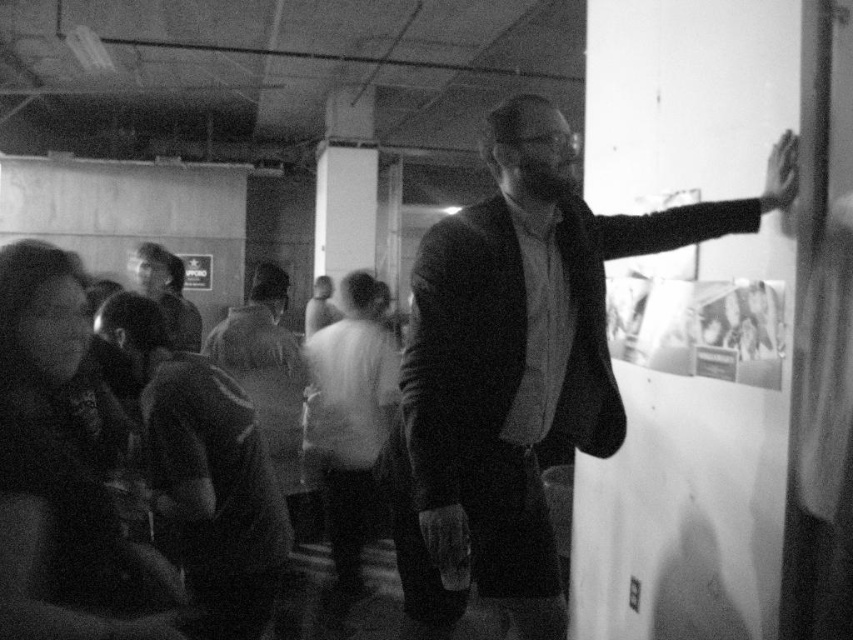
Question: Can you confirm if dark fabric jacket at lower left is smaller than smooth beige shirt at center?

Choices:
 (A) no
 (B) yes

Answer: (B)

Question: Can you confirm if dark fabric jacket at lower left is bigger than smooth skin hand at upper right?

Choices:
 (A) no
 (B) yes

Answer: (B)

Question: Which of the following is the closest to the observer?

Choices:
 (A) matte black suit at center
 (B) smooth skin hand at upper right
 (C) dark fabric jacket at lower left

Answer: (A)

Question: Is matte black suit at center to the right of smooth skin hand at upper right from the viewer's perspective?

Choices:
 (A) yes
 (B) no

Answer: (B)

Question: Which object appears farthest from the camera in this image?

Choices:
 (A) smooth fabric shirt at center
 (B) smooth skin hand at upper right
 (C) smooth beige shirt at center
 (D) matte black suit at center

Answer: (A)

Question: Which of these objects is positioned farthest from the dark fabric jacket at lower left?

Choices:
 (A) smooth beige shirt at center
 (B) matte black suit at center
 (C) smooth skin hand at upper right
 (D) smooth fabric shirt at center

Answer: (D)